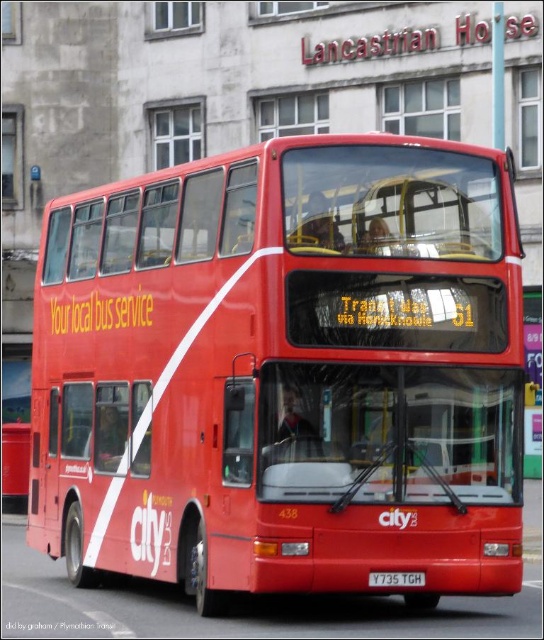
Does shiny red bus at center have a larger size compared to black metal license plate at center?

Incorrect, shiny red bus at center is not larger than black metal license plate at center.

Find the location of a particular element. shiny red bus at center is located at coordinates (285, 371).

Locate an element on the screen. The image size is (544, 640). shiny red bus at center is located at coordinates (x=285, y=371).